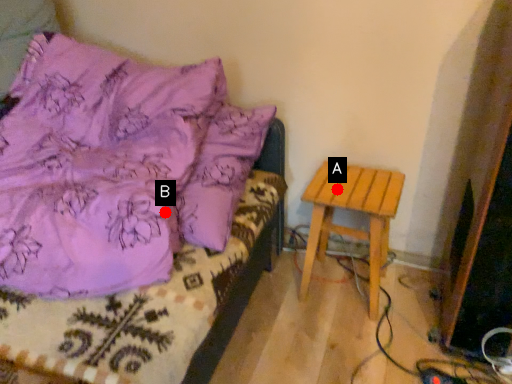
Question: Two points are circled on the image, labeled by A and B beside each circle. Which point is further to the camera?

Choices:
 (A) A is further
 (B) B is further

Answer: (A)